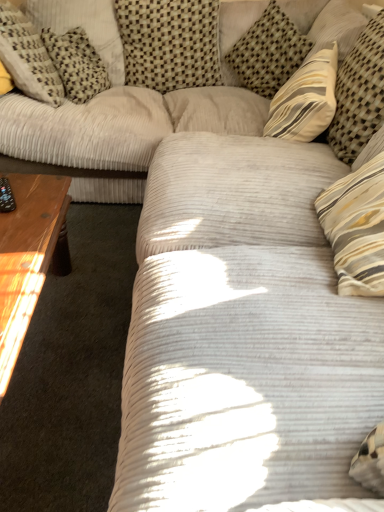
Question: Is light brown wooden coffee table at left far away from white corduroy pillow at upper left, which is counted as the 5th pillow, starting from the right?

Choices:
 (A) yes
 (B) no

Answer: (B)

Question: Can you confirm if light brown wooden coffee table at left is smaller than white corduroy pillow at upper left, marked as the first pillow in a left-to-right arrangement?

Choices:
 (A) yes
 (B) no

Answer: (B)

Question: Is light brown wooden coffee table at left closer to camera compared to white corduroy pillow at upper left, which is counted as the 5th pillow, starting from the right?

Choices:
 (A) no
 (B) yes

Answer: (B)

Question: Is light brown wooden coffee table at left to the left of white corduroy pillow at upper left, marked as the first pillow in a left-to-right arrangement, from the viewer's perspective?

Choices:
 (A) yes
 (B) no

Answer: (B)

Question: Are light brown wooden coffee table at left and white corduroy pillow at upper left, marked as the first pillow in a left-to-right arrangement, beside each other?

Choices:
 (A) yes
 (B) no

Answer: (B)

Question: Does light brown wooden coffee table at left have a larger size compared to white corduroy pillow at upper left, marked as the first pillow in a left-to-right arrangement?

Choices:
 (A) yes
 (B) no

Answer: (A)

Question: Is striped fabric pillow at upper right, the 1th pillow when ordered from right to left, placed right next to woven beige pillow at upper center, the third pillow from the left?

Choices:
 (A) no
 (B) yes

Answer: (A)

Question: From a real-world perspective, is striped fabric pillow at upper right, the 1th pillow when ordered from right to left, beneath woven beige pillow at upper center, the third pillow from the left?

Choices:
 (A) yes
 (B) no

Answer: (B)

Question: Does striped fabric pillow at upper right, the 5th pillow in the left-to-right sequence, have a smaller size compared to woven beige pillow at upper center, the 3th pillow from the right?

Choices:
 (A) yes
 (B) no

Answer: (A)

Question: Would you consider striped fabric pillow at upper right, the 1th pillow when ordered from right to left, to be distant from woven beige pillow at upper center, the third pillow from the left?

Choices:
 (A) yes
 (B) no

Answer: (B)

Question: Is the depth of striped fabric pillow at upper right, the 5th pillow in the left-to-right sequence, greater than that of woven beige pillow at upper center, the third pillow from the left?

Choices:
 (A) yes
 (B) no

Answer: (B)

Question: Does striped fabric pillow at upper right, the 5th pillow in the left-to-right sequence, have a larger size compared to woven beige pillow at upper center, the 3th pillow from the right?

Choices:
 (A) no
 (B) yes

Answer: (A)

Question: Is striped fabric pillow at upper right, the 1th pillow when ordered from right to left, touching white corduroy pillow at upper left, which is counted as the 5th pillow, starting from the right?

Choices:
 (A) yes
 (B) no

Answer: (B)